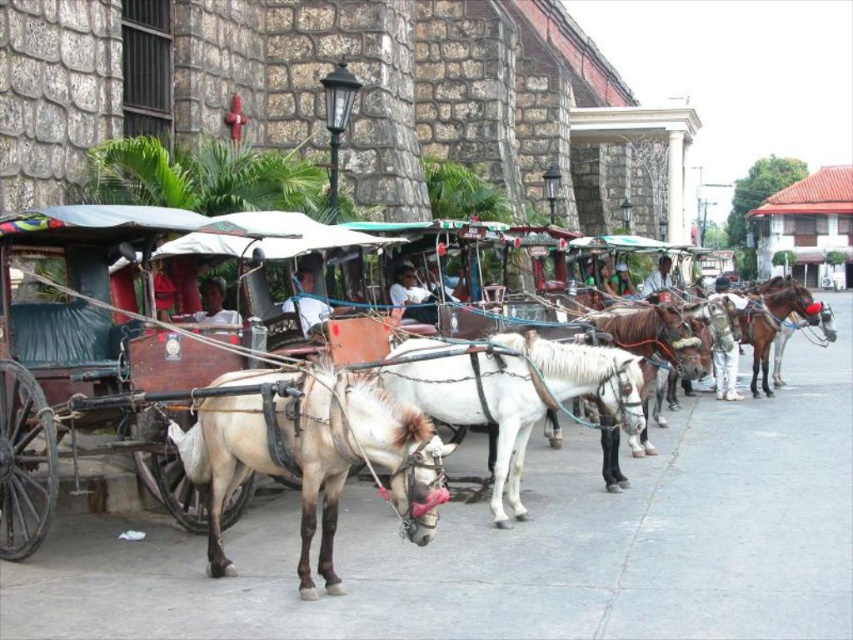
Question: Does light blue fabric at center lie behind white fabric shirt at center?

Choices:
 (A) yes
 (B) no

Answer: (B)

Question: Estimate the real-world distances between objects in this image. Which object is closer to the white fabric shirt at center?

Choices:
 (A) light brown leather donkey at center
 (B) light blue fabric at center
 (C) gray concrete pavement at center
 (D) camouflage-patterned jacket at center

Answer: (D)

Question: Which point is closer to the camera?

Choices:
 (A) (659, 259)
 (B) (624, 422)
 (C) (627, 288)
 (D) (238, 372)

Answer: (D)

Question: Which is nearer to the light brown skin at center?

Choices:
 (A) light brown leather donkey at center
 (B) brown glossy horse at center
 (C) gray concrete pavement at center
 (D) white matte shirt at center

Answer: (A)

Question: Does light blue fabric at center appear on the left side of white fabric shirt at center?

Choices:
 (A) no
 (B) yes

Answer: (B)

Question: Can you confirm if white glossy horse at center is bigger than light brown skin at center?

Choices:
 (A) yes
 (B) no

Answer: (A)